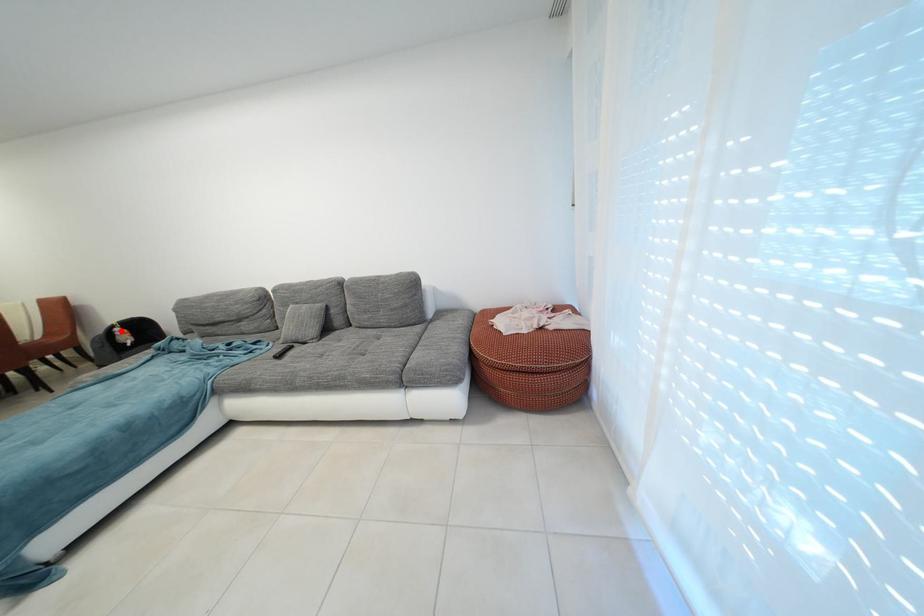
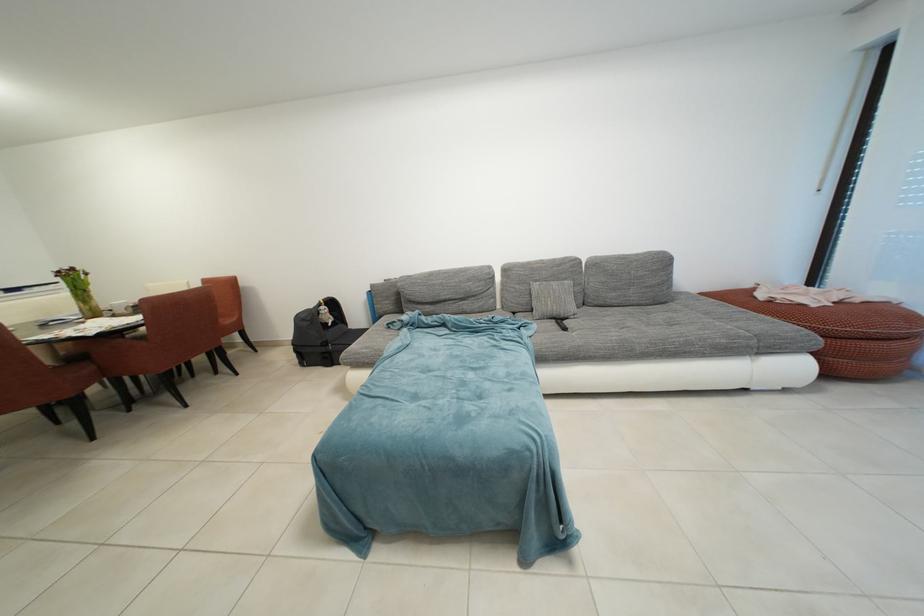
Question: A red point is marked in image1. In image2, is the corresponding 3D point closer to the camera or farther? Reply with the corresponding letter.

Choices:
 (A) The corresponding 3D point is closer.
 (B) The corresponding 3D point is farther.

Answer: (A)